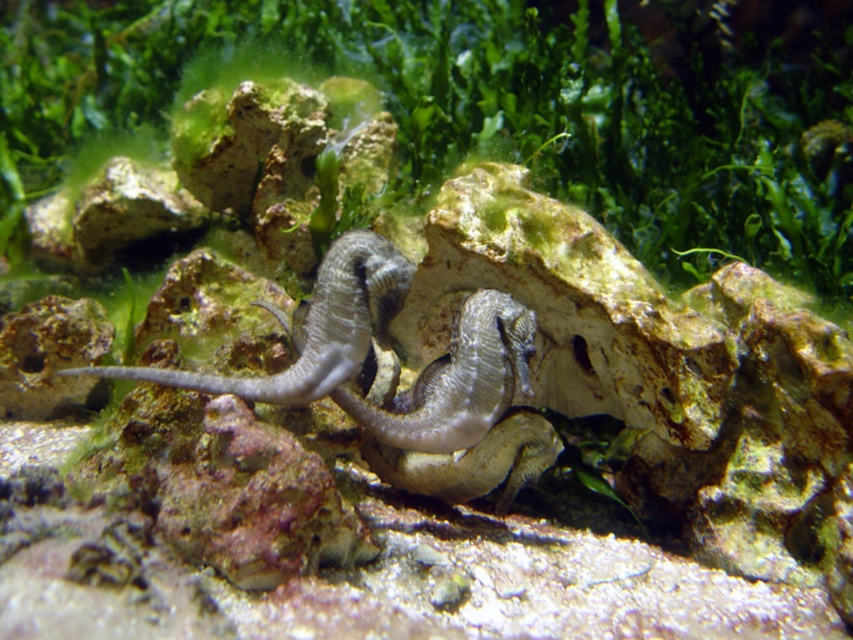
What do you see at coordinates (485, 106) in the screenshot? I see `green algae at center` at bounding box center [485, 106].

Between point (790, 147) and point (117, 369), which one is positioned in front?

Point (117, 369) is in front.

At what (x,y) coordinates should I click in order to perform the action: click on green algae at center. Please return your answer as a coordinate pair (x, y). Looking at the image, I should click on (485, 106).